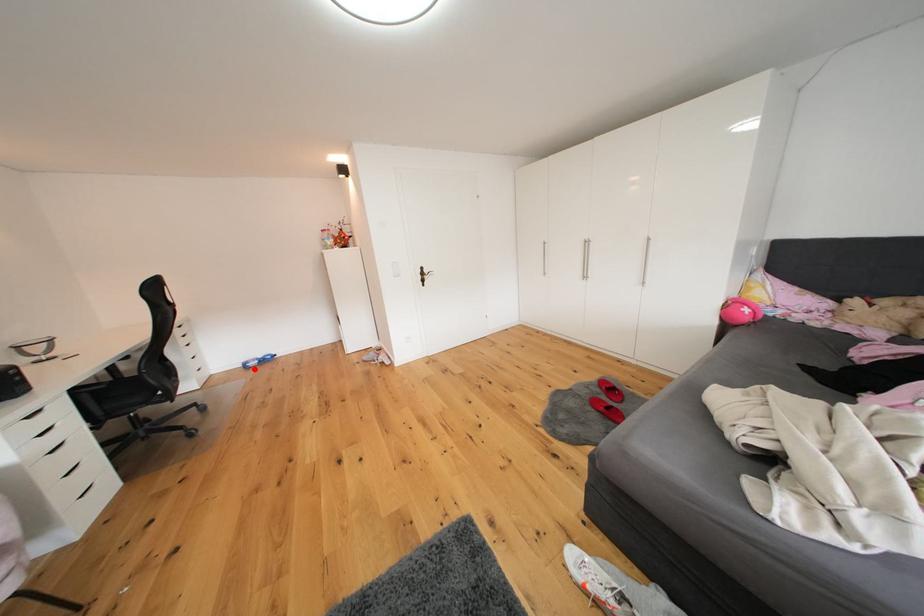
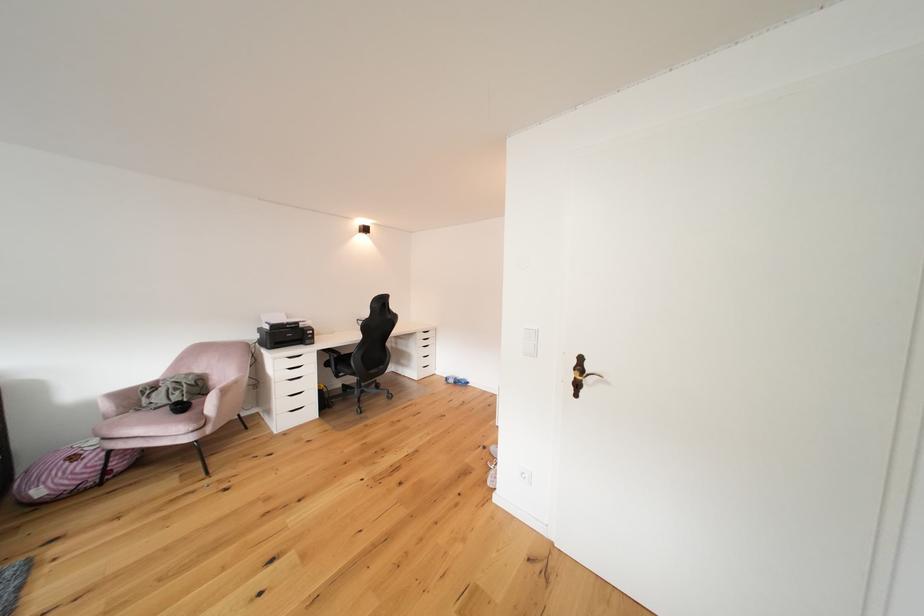
Find the pixel in the second image that matches the highlighted location in the first image.

(456, 383)